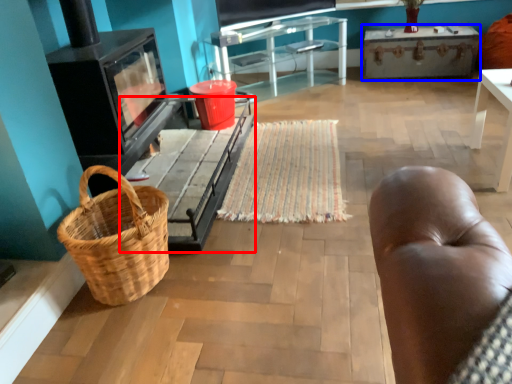
Question: Which of the following is the farthest to the observer, table (highlighted by a red box) or table (highlighted by a blue box)?

Choices:
 (A) table
 (B) table

Answer: (B)